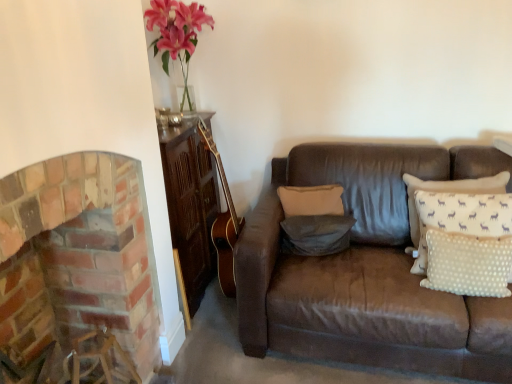
Question: Considering the relative positions of white dotted fabric pillow at right, the 3th pillow viewed from the back, and beige fabric pillow at center, placed as the 1th pillow when sorted from back to front, in the image provided, is white dotted fabric pillow at right, the 3th pillow viewed from the back, to the right of beige fabric pillow at center, placed as the 1th pillow when sorted from back to front, from the viewer's perspective?

Choices:
 (A) no
 (B) yes

Answer: (B)

Question: Does white dotted fabric pillow at right, the 3th pillow viewed from the back, appear on the left side of beige fabric pillow at center, placed as the 1th pillow when sorted from back to front?

Choices:
 (A) yes
 (B) no

Answer: (B)

Question: Is white dotted fabric pillow at right, the 3th pillow viewed from the back, taller than beige fabric pillow at center, which is the third pillow from front to back?

Choices:
 (A) yes
 (B) no

Answer: (A)

Question: Is white dotted fabric pillow at right, the 3th pillow viewed from the back, wider than beige fabric pillow at center, which is the third pillow from front to back?

Choices:
 (A) yes
 (B) no

Answer: (B)

Question: From a real-world perspective, is white dotted fabric pillow at right, marked as the 1th pillow in a front-to-back arrangement, physically above beige fabric pillow at center, placed as the 1th pillow when sorted from back to front?

Choices:
 (A) yes
 (B) no

Answer: (B)

Question: In the image, is white dotted fabric pillow at right, the 3th pillow viewed from the back, on the left side or the right side of brick fireplace at left?

Choices:
 (A) left
 (B) right

Answer: (B)

Question: In the image, is white dotted fabric pillow at right, the 3th pillow viewed from the back, positioned in front of or behind brick fireplace at left?

Choices:
 (A) behind
 (B) front

Answer: (A)

Question: Is point (463, 244) positioned closer to the camera than point (38, 216)?

Choices:
 (A) closer
 (B) farther

Answer: (B)

Question: In terms of size, does white dotted fabric pillow at right, marked as the 1th pillow in a front-to-back arrangement, appear bigger or smaller than brick fireplace at left?

Choices:
 (A) big
 (B) small

Answer: (B)

Question: From their relative heights in the image, would you say gray fabric pillow at center, placed as the second pillow when sorted from front to back, is taller or shorter than white dotted fabric pillow at right, the 3th pillow viewed from the back?

Choices:
 (A) tall
 (B) short

Answer: (B)

Question: Looking at the image, does gray fabric pillow at center, placed as the second pillow when sorted from front to back, seem bigger or smaller compared to white dotted fabric pillow at right, the 3th pillow viewed from the back?

Choices:
 (A) big
 (B) small

Answer: (B)

Question: Considering their positions, is gray fabric pillow at center, the 2th pillow in the back-to-front sequence, located in front of or behind white dotted fabric pillow at right, the 3th pillow viewed from the back?

Choices:
 (A) behind
 (B) front

Answer: (A)

Question: Looking at their shapes, would you say gray fabric pillow at center, the 2th pillow in the back-to-front sequence, is wider or thinner than white dotted fabric pillow at right, marked as the 1th pillow in a front-to-back arrangement?

Choices:
 (A) thin
 (B) wide

Answer: (B)

Question: Does point (301, 192) appear closer or farther from the camera than point (83, 243)?

Choices:
 (A) closer
 (B) farther

Answer: (B)

Question: Considering the positions of beige fabric pillow at center, which is the third pillow from front to back, and brick fireplace at left in the image, is beige fabric pillow at center, which is the third pillow from front to back, taller or shorter than brick fireplace at left?

Choices:
 (A) short
 (B) tall

Answer: (A)